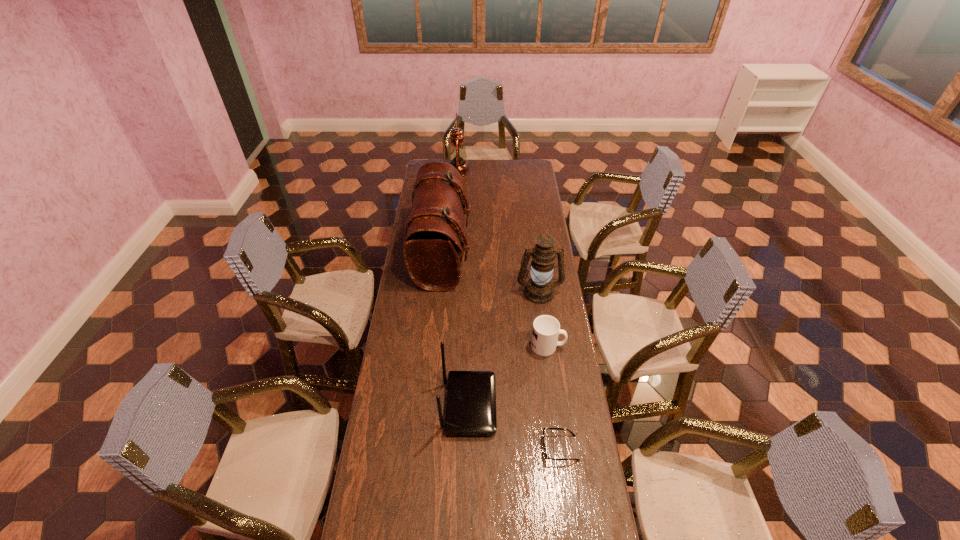
You are a GUI agent. You are given a task and a screenshot of the screen. Output one action in this format:
    pyautogui.click(x=<x>, y=<y>)
    Task: Click on the free spot between the nearer oil lamp and the farthest object
    The image size is (960, 540).
    Given the screenshot: What is the action you would take?
    pyautogui.click(x=498, y=232)

The height and width of the screenshot is (540, 960). Identify the location of free area in between the router and the third tallest object. (504, 349).

Locate an element on the screen. The image size is (960, 540). free space between the router and the spectacles is located at coordinates (515, 427).

Locate an element on the screen. The image size is (960, 540). vacant space that is in between the spectacles and the fourth farthest object is located at coordinates (554, 397).

At what (x,y) coordinates should I click in order to perform the action: click on object that is the fifth nearest to the satchel. Please return your answer as a coordinate pair (x, y). Looking at the image, I should click on (547, 458).

Locate which object is the second closest to the second shortest object. Please provide its 2D coordinates. Your answer should be formatted as a tuple, i.e. [(x, y)], where the tuple contains the x and y coordinates of a point satisfying the conditions above.

[(471, 395)]

This screenshot has height=540, width=960. Identify the location of free space that satisfies the following two spatial constraints: 1. on the back side of the nearer oil lamp; 2. on the front-facing side of the satchel. (534, 254).

I want to click on free space that satisfies the following two spatial constraints: 1. on the front-facing side of the nearer oil lamp; 2. on the right side of the satchel, so point(439,292).

Where is `free space that satisfies the following two spatial constraints: 1. on the back side of the right oil lamp; 2. on the front-facing side of the satchel`? This screenshot has height=540, width=960. free space that satisfies the following two spatial constraints: 1. on the back side of the right oil lamp; 2. on the front-facing side of the satchel is located at coordinates (534, 254).